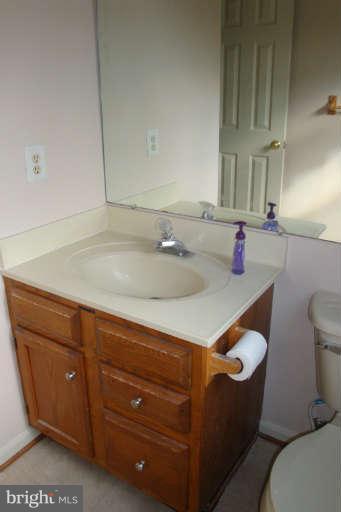
Find the location of a particular element. The height and width of the screenshot is (512, 341). faucet is located at coordinates (170, 241).